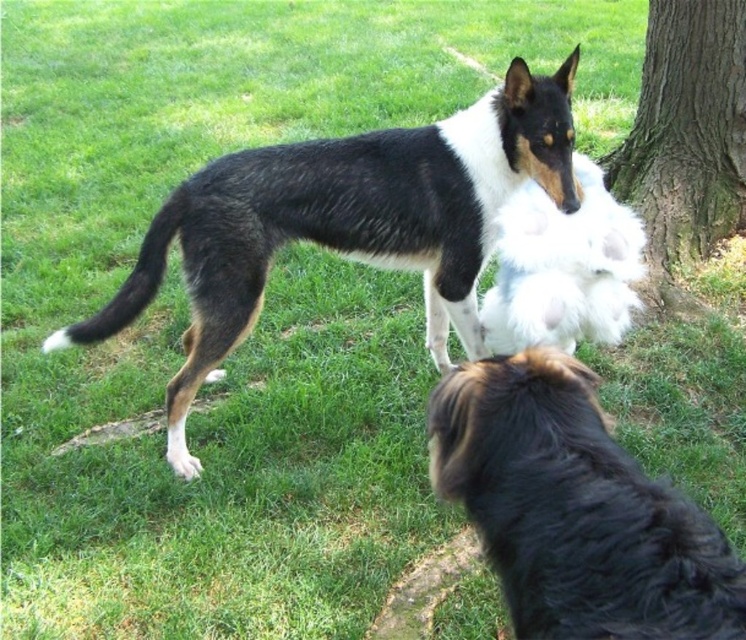
Can you confirm if brown rough bark tree at right is positioned to the left of fluffy white stuffed toy at center?

Incorrect, brown rough bark tree at right is not on the left side of fluffy white stuffed toy at center.

Between brown rough bark tree at right and fluffy white stuffed toy at center, which one has more height?

brown rough bark tree at right is taller.

Does point (671, 35) come behind point (589, 195)?

Yes.

I want to click on brown rough bark tree at right, so click(x=686, y=132).

Which is above, black fluffy dog at lower right or brown rough bark tree at right?

brown rough bark tree at right is above.

Measure the distance between black fluffy dog at lower right and camera.

black fluffy dog at lower right is 39.06 inches from camera.

What do you see at coordinates (574, 509) in the screenshot? I see `black fluffy dog at lower right` at bounding box center [574, 509].

Find the location of a particular element. black fluffy dog at lower right is located at coordinates (574, 509).

Is black and white fur at center bigger than brown rough bark tree at right?

Yes.

Is black and white fur at center closer to camera compared to brown rough bark tree at right?

That is True.

You are a GUI agent. You are given a task and a screenshot of the screen. Output one action in this format:
    pyautogui.click(x=<x>, y=<y>)
    Task: Click on the black and white fur at center
    The image size is (746, 640).
    Given the screenshot: What is the action you would take?
    pyautogui.click(x=347, y=221)